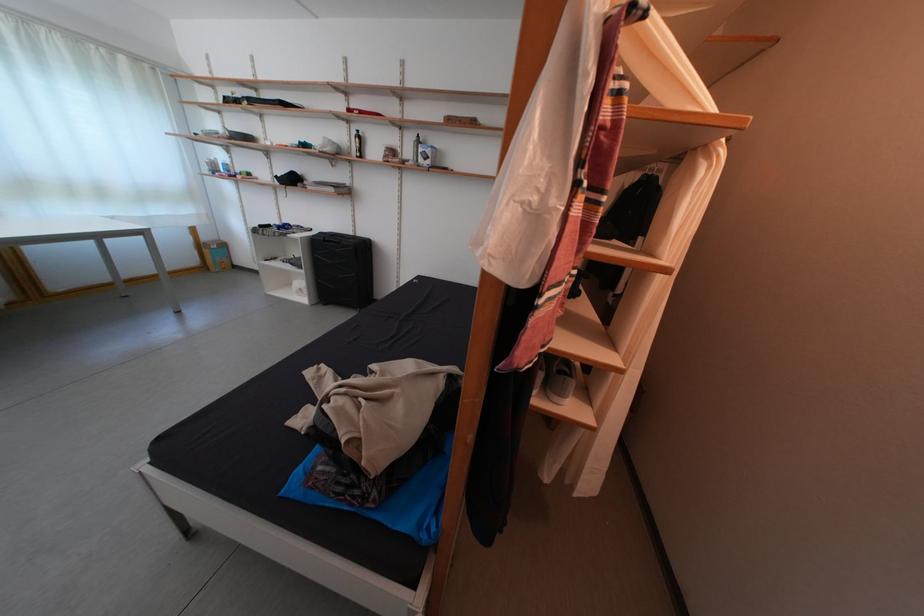
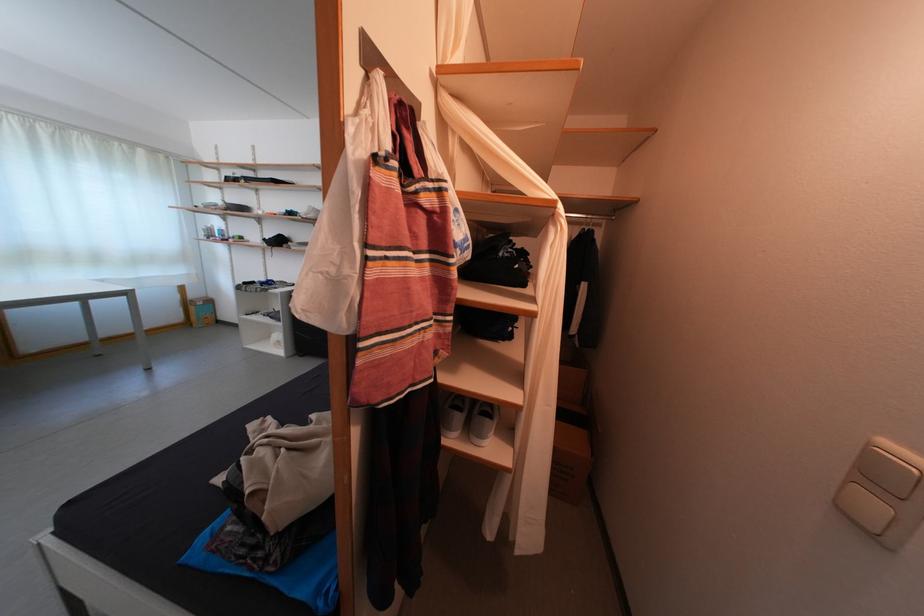
The point at [213,244] is marked in the first image. Where is the corresponding point in the second image?

(201, 302)